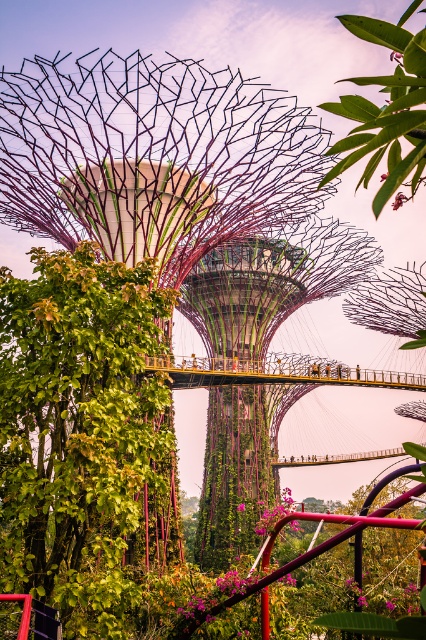
You are standing at the base of the futuristic tree structure and want to take a photo of the green leafy tree at upper center without the green leafy plant at left blocking the view. Is this possible?

Yes, because the green leafy tree at upper center is behind the green leafy plant at left, so positioning yourself so that the plant is between you and the tree would allow you to frame the tree without obstruction.

You are a visitor at the Gardens by the Bay and notice the green leafy plant at left and the green textured tower at center. Which object is closer to the ground?

The green leafy plant at left is positioned under the green textured tower at center, so it is closer to the ground.